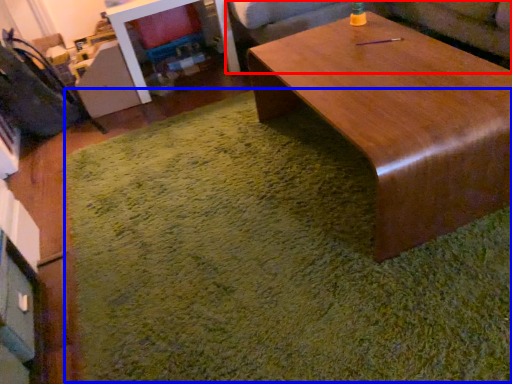
Question: Which object is further to the camera taking this photo, couch (highlighted by a red box) or mat (highlighted by a blue box)?

Choices:
 (A) couch
 (B) mat

Answer: (A)